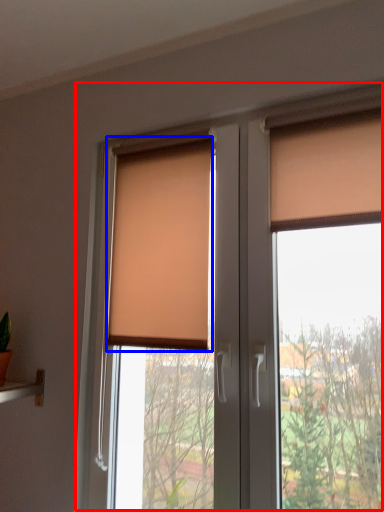
Question: Which of the following is the farthest to the observer, window (highlighted by a red box) or window blind (highlighted by a blue box)?

Choices:
 (A) window
 (B) window blind

Answer: (B)